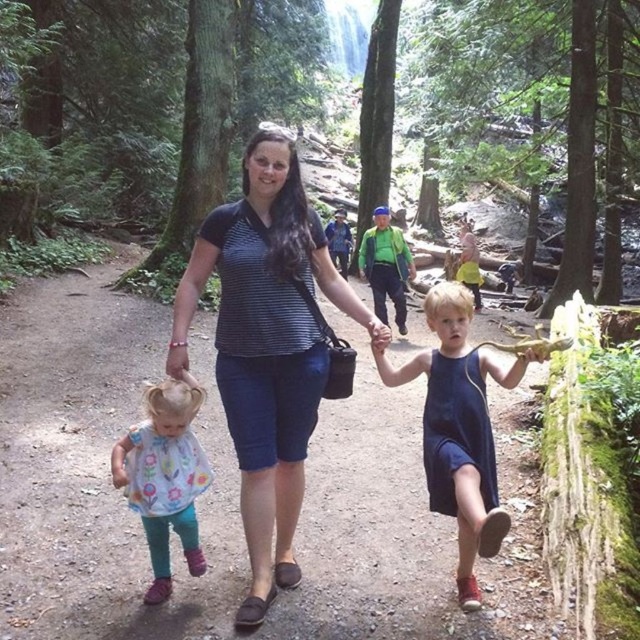
Question: Can you confirm if striped fabric shirt at center is smaller than blue fabric dress at center?

Choices:
 (A) no
 (B) yes

Answer: (A)

Question: Considering the relative positions of blue denim dress at center and green matte forest at center in the image provided, where is blue denim dress at center located with respect to green matte forest at center?

Choices:
 (A) above
 (B) below

Answer: (B)

Question: Among these points, which one is nearest to the camera?

Choices:
 (A) (x=220, y=97)
 (B) (x=467, y=593)
 (C) (x=195, y=401)

Answer: (C)

Question: Does blue denim dress at center have a greater width compared to blue fabric dress at center?

Choices:
 (A) yes
 (B) no

Answer: (A)

Question: Estimate the real-world distances between objects in this image. Which object is farther from the green matte forest at center?

Choices:
 (A) striped fabric shirt at center
 (B) floral-patterned fabric dress at lower left
 (C) blue fabric dress at center
 (D) blue denim dress at center

Answer: (D)

Question: Which point is farther to the camera?

Choices:
 (A) (182, 545)
 (B) (483, 508)
 (C) (205, 179)

Answer: (C)